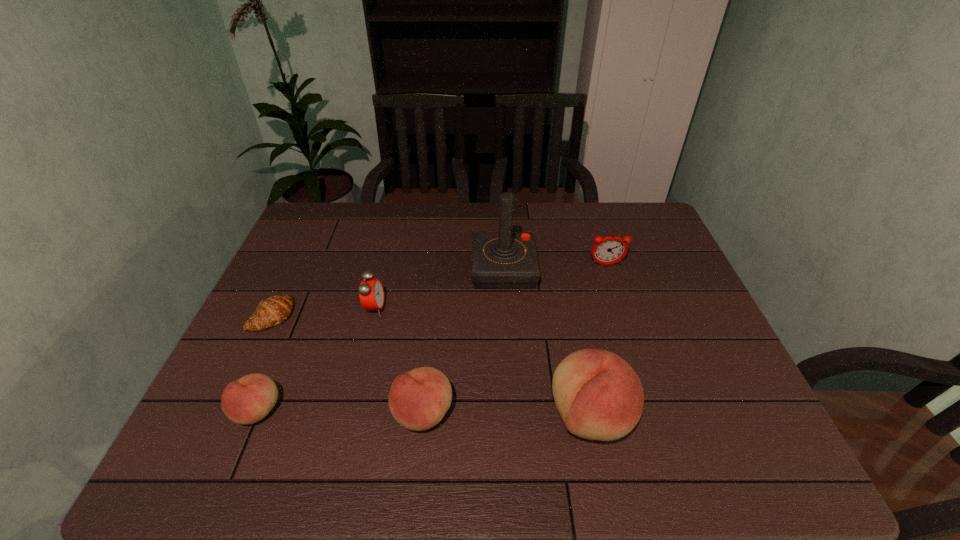
This screenshot has height=540, width=960. Identify the location of vacant area between the joystick and the crescent roll. (388, 293).

The image size is (960, 540). Identify the location of free space between the tallest object and the leftmost peach. (x=380, y=340).

You are a GUI agent. You are given a task and a screenshot of the screen. Output one action in this format:
    pyautogui.click(x=<x>, y=<y>)
    Task: Click on the free space between the sixth shortest object and the fourth object from right to left
    Image resolution: width=960 pixels, height=540 pixels.
    Given the screenshot: What is the action you would take?
    pyautogui.click(x=507, y=415)

Where is `vacant space that is in between the tallest object and the rightmost peach`? The height and width of the screenshot is (540, 960). vacant space that is in between the tallest object and the rightmost peach is located at coordinates (547, 343).

This screenshot has width=960, height=540. In order to click on vacant area that lies between the shortest peach and the joystick in this screenshot , I will do `click(380, 340)`.

Image resolution: width=960 pixels, height=540 pixels. Find the location of `empty space between the joystick and the nearer alarm clock`. empty space between the joystick and the nearer alarm clock is located at coordinates (440, 289).

Identify which object is located as the second nearest to the fifth object from right to left. Please provide its 2D coordinates. Your answer should be formatted as a tuple, i.e. [(x, y)], where the tuple contains the x and y coordinates of a point satisfying the conditions above.

[(418, 400)]

Identify the location of object that is the sixth closest one to the joystick. (249, 399).

Choose which peach is the nearest neighbor to the second peach from right to left. Please provide its 2D coordinates. Your answer should be formatted as a tuple, i.e. [(x, y)], where the tuple contains the x and y coordinates of a point satisfying the conditions above.

[(599, 396)]

Find the location of `peach that stands as the third closest to the tallest object`. peach that stands as the third closest to the tallest object is located at coordinates (249, 399).